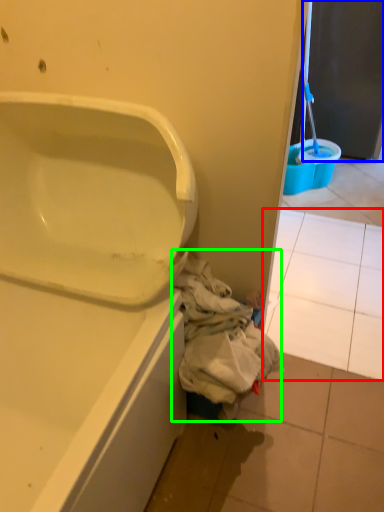
Question: Estimate the real-world distances between objects in this image. Which object is farther from tile (highlighted by a red box), screen door (highlighted by a blue box) or garbage (highlighted by a green box)?

Choices:
 (A) screen door
 (B) garbage

Answer: (A)